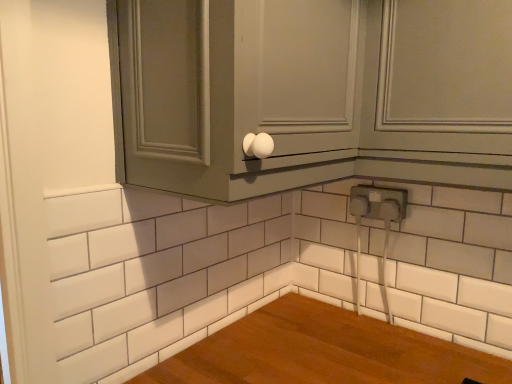
Question: Are matte gray cabinet at upper center and white plastic electrical outlet at lower right beside each other?

Choices:
 (A) yes
 (B) no

Answer: (B)

Question: Is matte gray cabinet at upper center oriented away from white plastic electrical outlet at lower right?

Choices:
 (A) yes
 (B) no

Answer: (B)

Question: Would you consider matte gray cabinet at upper center to be distant from white plastic electrical outlet at lower right?

Choices:
 (A) yes
 (B) no

Answer: (B)

Question: Can you confirm if matte gray cabinet at upper center is positioned to the right of white plastic electrical outlet at lower right?

Choices:
 (A) yes
 (B) no

Answer: (B)

Question: Does matte gray cabinet at upper center have a larger size compared to white plastic electrical outlet at lower right?

Choices:
 (A) yes
 (B) no

Answer: (A)

Question: From a real-world perspective, is matte gray cabinet at upper center physically above white plastic electrical outlet at lower right?

Choices:
 (A) no
 (B) yes

Answer: (B)

Question: From a real-world perspective, is white plastic electrical outlet at lower right positioned over matte gray cabinet at upper right based on gravity?

Choices:
 (A) yes
 (B) no

Answer: (B)

Question: Considering the relative sizes of white plastic electrical outlet at lower right and matte gray cabinet at upper right in the image provided, is white plastic electrical outlet at lower right smaller than matte gray cabinet at upper right?

Choices:
 (A) yes
 (B) no

Answer: (A)

Question: Can you confirm if white plastic electrical outlet at lower right is taller than matte gray cabinet at upper right?

Choices:
 (A) no
 (B) yes

Answer: (A)

Question: Is white plastic electrical outlet at lower right facing towards matte gray cabinet at upper right?

Choices:
 (A) yes
 (B) no

Answer: (B)

Question: Is white plastic electrical outlet at lower right behind matte gray cabinet at upper right?

Choices:
 (A) no
 (B) yes

Answer: (B)

Question: From the image's perspective, is white plastic electrical outlet at lower right below matte gray cabinet at upper right?

Choices:
 (A) no
 (B) yes

Answer: (B)

Question: Is the depth of white plastic electrical outlet at lower right greater than that of matte gray cabinet at upper center?

Choices:
 (A) yes
 (B) no

Answer: (A)